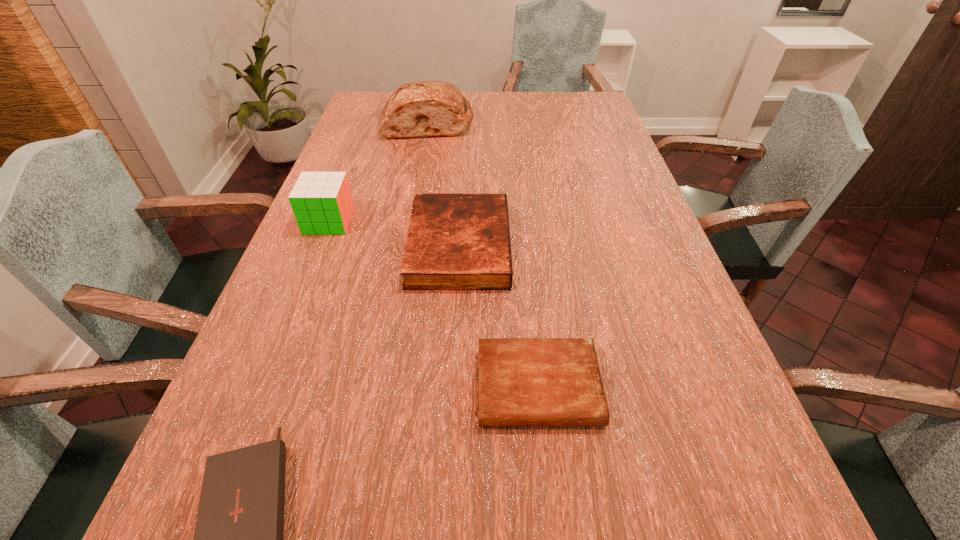
This screenshot has height=540, width=960. I want to click on the tallest object, so click(426, 108).

At what (x,y) coordinates should I click in order to perform the action: click on bread. Please return your answer as a coordinate pair (x, y). The image size is (960, 540). Looking at the image, I should click on click(426, 108).

This screenshot has height=540, width=960. Find the location of `the second tallest object`. the second tallest object is located at coordinates (322, 203).

Locate an element on the screen. Image resolution: width=960 pixels, height=540 pixels. the third tallest object is located at coordinates (455, 241).

Identify the location of the tallest Bible. (455, 241).

Identify the location of free space located 0.250m at the sliced front of the bread. (418, 185).

This screenshot has height=540, width=960. I want to click on free spot located on the back of the cube, so click(x=339, y=195).

The image size is (960, 540). In order to click on vacant area situated 0.240m on the spine side of the third shortest object in this screenshot , I will do [609, 246].

Locate an element on the screen. This screenshot has height=540, width=960. object located in the far edge section of the desktop is located at coordinates (426, 108).

This screenshot has height=540, width=960. In order to click on bread present at the left edge in this screenshot , I will do `click(426, 108)`.